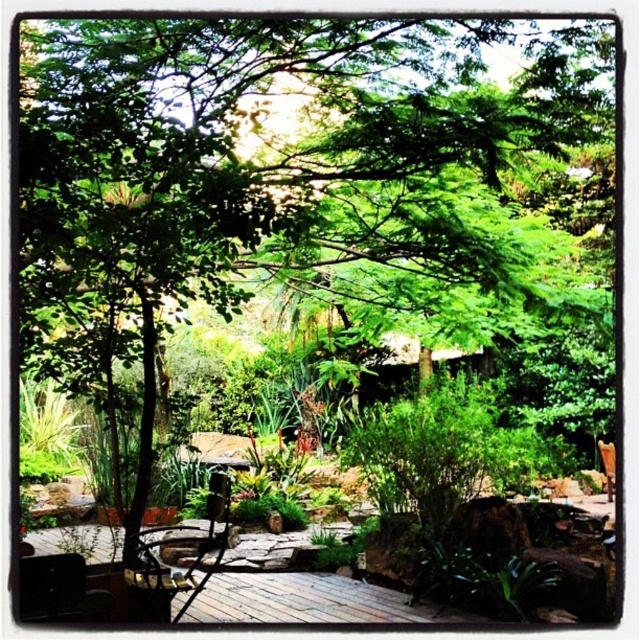
Question: Where is matte black chair at lower left located in relation to brown wooden chair at lower right in the image?

Choices:
 (A) below
 (B) above

Answer: (B)

Question: Which of the following is the farthest from the observer?

Choices:
 (A) (198, 529)
 (B) (36, 577)
 (C) (596, 449)

Answer: (C)

Question: Is the position of metallic silver chair at center less distant than that of brown wooden chair at lower right?

Choices:
 (A) yes
 (B) no

Answer: (A)

Question: Which object is closer to the camera taking this photo?

Choices:
 (A) metallic silver chair at center
 (B) matte black chair at lower left

Answer: (B)

Question: Considering the relative positions of matte black chair at lower left and brown wooden chair at lower right in the image provided, where is matte black chair at lower left located with respect to brown wooden chair at lower right?

Choices:
 (A) left
 (B) right

Answer: (A)

Question: Which of these objects is positioned farthest from the matte black chair at lower left?

Choices:
 (A) brown wooden chair at lower right
 (B) metallic silver chair at center

Answer: (A)